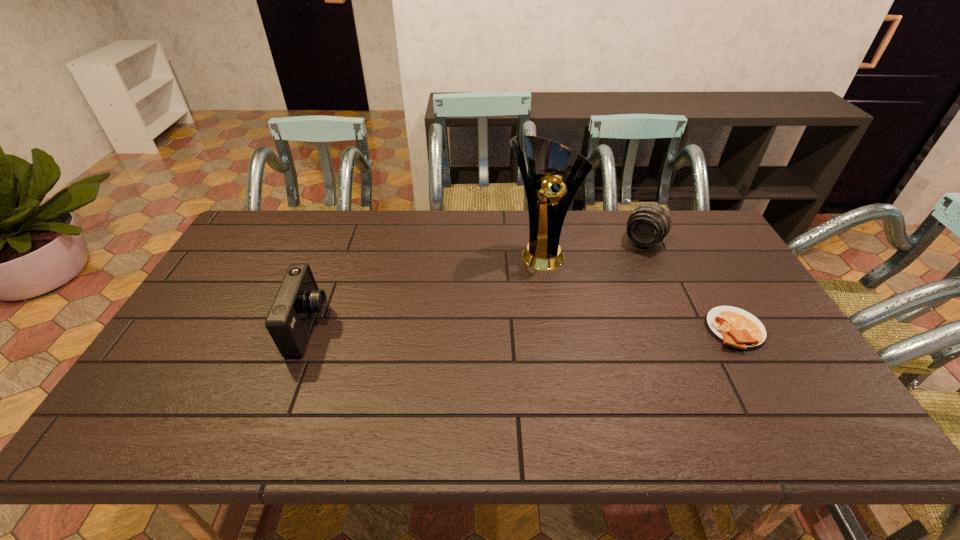
Where is `empty space between the telephoto lens and the second object from left to right`? empty space between the telephoto lens and the second object from left to right is located at coordinates (592, 246).

Select which object is the third closest to the leftmost object. Please provide its 2D coordinates. Your answer should be formatted as a tuple, i.e. [(x, y)], where the tuple contains the x and y coordinates of a point satisfying the conditions above.

[(732, 326)]

Locate an element on the screen. The width and height of the screenshot is (960, 540). object that is the closest to the leftmost object is located at coordinates (548, 197).